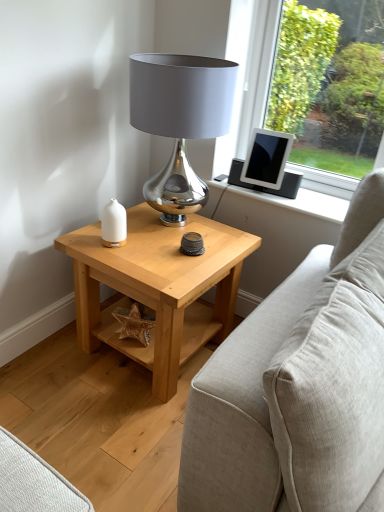
Locate an element on the screen. This screenshot has width=384, height=512. vacant space situated on the left part of white matte candle holder at left is located at coordinates (84, 241).